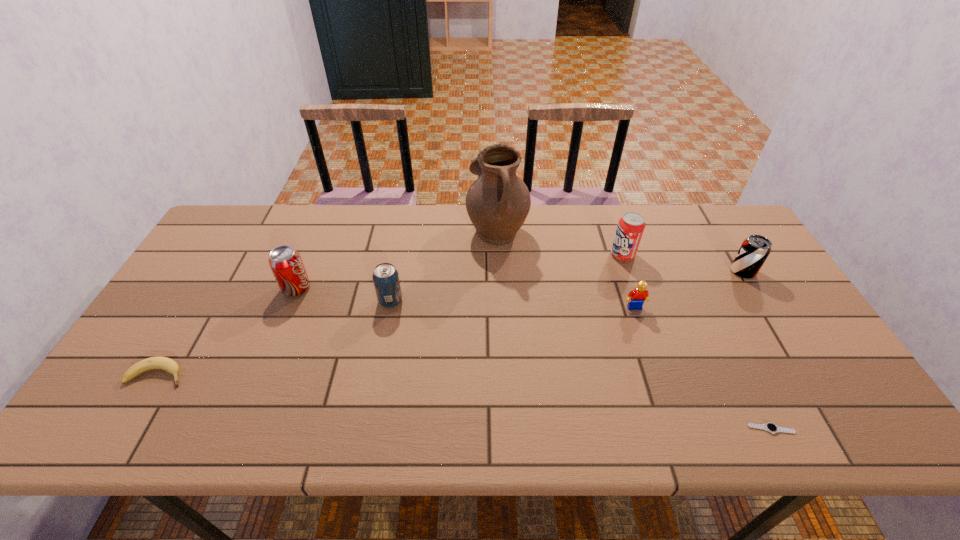
Locate an element on the screen. the fourth object from left to right is located at coordinates (498, 202).

Find the location of `pitcher`. pitcher is located at coordinates (498, 202).

I want to click on the second soda can from right to left, so click(630, 228).

Where is `the second object from left to right`? The width and height of the screenshot is (960, 540). the second object from left to right is located at coordinates (285, 262).

Locate an element on the screen. Image resolution: width=960 pixels, height=540 pixels. the third soda can from right to left is located at coordinates (385, 276).

Locate an element on the screen. The image size is (960, 540). the rightmost object is located at coordinates (752, 254).

Locate an element on the screen. This screenshot has height=540, width=960. the sixth tallest object is located at coordinates click(640, 294).

At what (x,y) coordinates should I click in order to perform the action: click on the seventh tallest object. Please return your answer as a coordinate pair (x, y). The height and width of the screenshot is (540, 960). Looking at the image, I should click on (164, 363).

The width and height of the screenshot is (960, 540). Find the location of `the leftmost object`. the leftmost object is located at coordinates (164, 363).

This screenshot has width=960, height=540. Identify the location of watch. (770, 427).